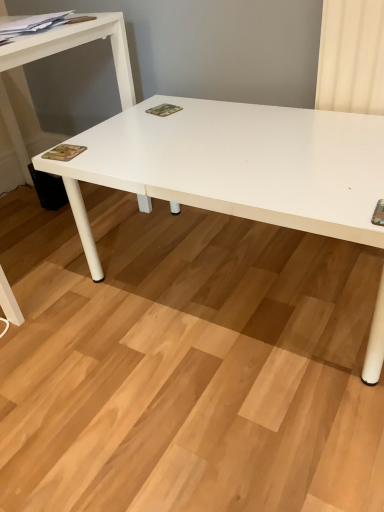
Question: Is camouflage fabric magazine at center, the second magazine when ordered from bottom to top, positioned behind white matte table at left?

Choices:
 (A) no
 (B) yes

Answer: (B)

Question: Does camouflage fabric magazine at center, the 2th magazine in the top-to-bottom sequence, appear on the left side of white matte table at left?

Choices:
 (A) no
 (B) yes

Answer: (A)

Question: Does camouflage fabric magazine at center, the third magazine when ordered from left to right, have a greater height compared to white matte table at left?

Choices:
 (A) yes
 (B) no

Answer: (B)

Question: Is camouflage fabric magazine at center, the 2th magazine in the top-to-bottom sequence, not near white matte table at left?

Choices:
 (A) yes
 (B) no

Answer: (B)

Question: From the image's perspective, is camouflage fabric magazine at center, the second magazine when ordered from bottom to top, located above white matte table at left?

Choices:
 (A) no
 (B) yes

Answer: (B)

Question: Is camouflage fabric magazine at center, the second magazine when ordered from bottom to top, thinner than white matte table at left?

Choices:
 (A) no
 (B) yes

Answer: (B)

Question: Is white matte table at left located within camouflage paper at lower left, placed as the second magazine when sorted from left to right?

Choices:
 (A) no
 (B) yes

Answer: (A)

Question: Considering the relative sizes of camouflage paper at lower left, the third magazine when ordered from top to bottom, and white matte table at left in the image provided, is camouflage paper at lower left, the third magazine when ordered from top to bottom, shorter than white matte table at left?

Choices:
 (A) no
 (B) yes

Answer: (B)

Question: Does camouflage paper at lower left, the 1th magazine in the bottom-to-top sequence, have a smaller size compared to white matte table at left?

Choices:
 (A) yes
 (B) no

Answer: (A)

Question: From a real-world perspective, is camouflage paper at lower left, the third magazine when ordered from top to bottom, located higher than white matte table at left?

Choices:
 (A) yes
 (B) no

Answer: (A)

Question: Is camouflage paper at lower left, the third magazine when ordered from top to bottom, at the left side of white matte table at left?

Choices:
 (A) yes
 (B) no

Answer: (B)

Question: Is camouflage paper at lower left, placed as the second magazine when sorted from left to right, facing away from white matte table at left?

Choices:
 (A) no
 (B) yes

Answer: (A)

Question: Is white matte table at left positioned far away from camouflage paper at lower left, placed as the second magazine when sorted from left to right?

Choices:
 (A) no
 (B) yes

Answer: (A)